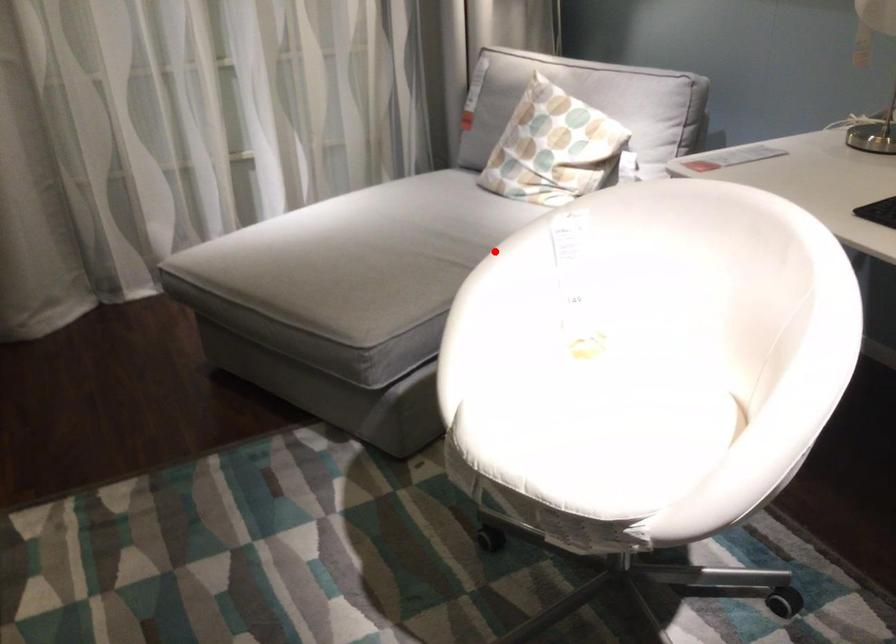
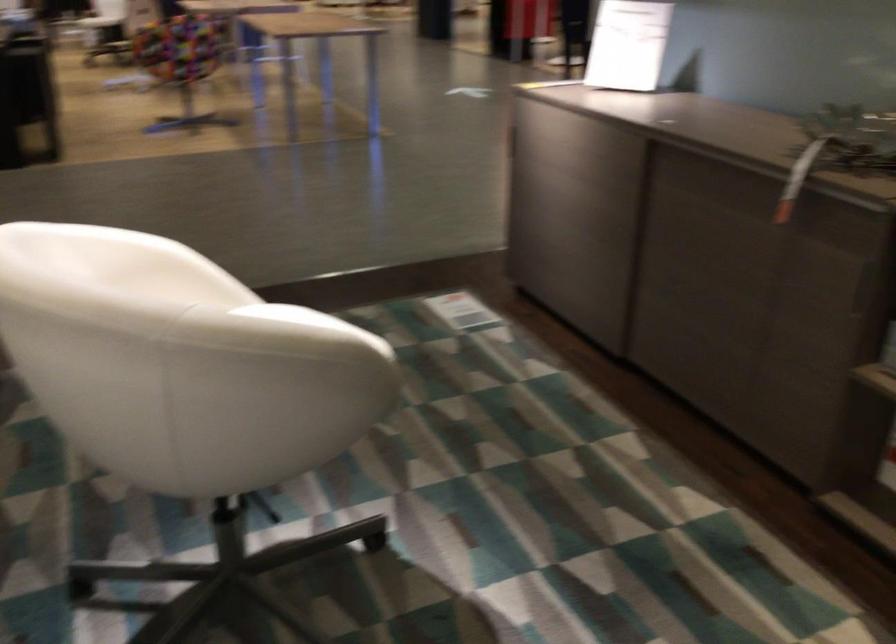
Question: I am providing you with two images of the same scene from different viewpoints. Given a red point in image1, look at the same physical point in image2. Is it:

Choices:
 (A) Closer to the viewpoint
 (B) Farther from the viewpoint

Answer: (A)